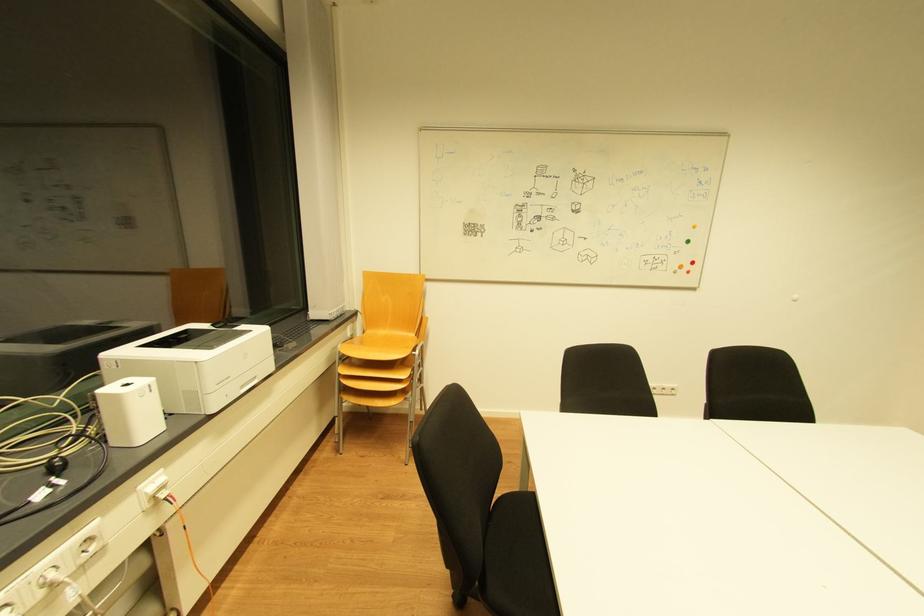
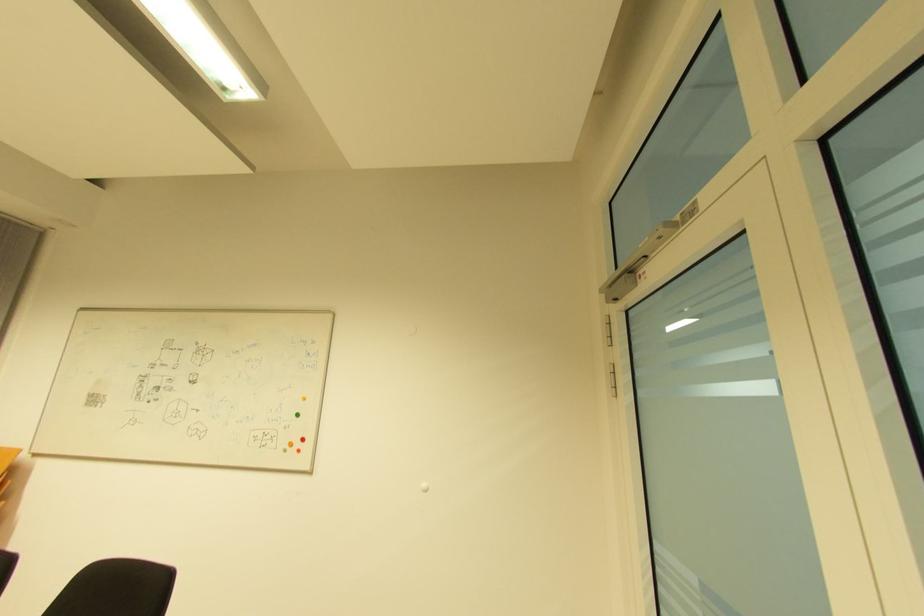
Question: The images are taken continuously from a first-person perspective. In which direction are you moving?

Choices:
 (A) Left
 (B) Right
 (C) Forward
 (D) Backward

Answer: (B)